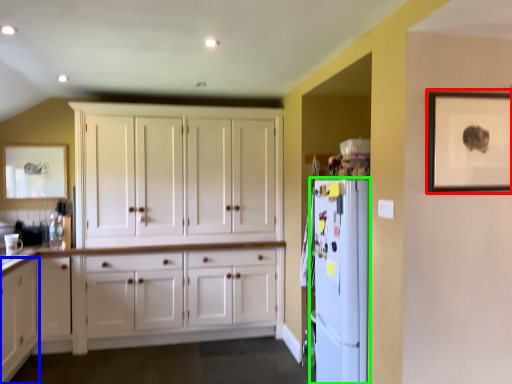
Question: Which object is positioned farthest from picture frame (highlighted by a red box)? Select from cabinetry (highlighted by a blue box) and refrigerator (highlighted by a green box).

Choices:
 (A) cabinetry
 (B) refrigerator

Answer: (A)